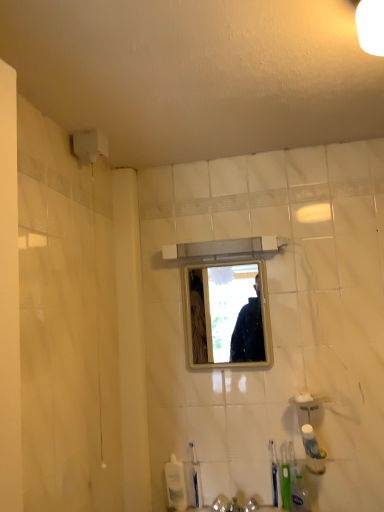
Question: Considering the relative sizes of green plastic toothbrush at lower right, which is the 2th toothbrush in right-to-left order, and blue plastic toothbrush at lower center, which is counted as the 1th toothbrush, starting from the left, in the image provided, is green plastic toothbrush at lower right, which is the 2th toothbrush in right-to-left order, taller than blue plastic toothbrush at lower center, which is counted as the 1th toothbrush, starting from the left,?

Choices:
 (A) no
 (B) yes

Answer: (B)

Question: Is green plastic toothbrush at lower right, which is the 2th toothbrush in right-to-left order, completely or partially outside of blue plastic toothbrush at lower center, which appears as the 3th toothbrush when viewed from the right?

Choices:
 (A) no
 (B) yes

Answer: (B)

Question: Is green plastic toothbrush at lower right, which ranks as the second toothbrush in left-to-right order, behind blue plastic toothbrush at lower center, which appears as the 3th toothbrush when viewed from the right?

Choices:
 (A) yes
 (B) no

Answer: (B)

Question: Could you tell me if green plastic toothbrush at lower right, which ranks as the second toothbrush in left-to-right order, is turned towards blue plastic toothbrush at lower center, which is counted as the 1th toothbrush, starting from the left?

Choices:
 (A) no
 (B) yes

Answer: (A)

Question: Considering the relative positions of green plastic toothbrush at lower right, which is the 2th toothbrush in right-to-left order, and blue plastic toothbrush at lower center, which appears as the 3th toothbrush when viewed from the right, in the image provided, is green plastic toothbrush at lower right, which is the 2th toothbrush in right-to-left order, to the right of blue plastic toothbrush at lower center, which appears as the 3th toothbrush when viewed from the right, from the viewer's perspective?

Choices:
 (A) yes
 (B) no

Answer: (A)

Question: From the image's perspective, does green plastic toothbrush at lower right, which is the 2th toothbrush in right-to-left order, appear lower than blue plastic toothbrush at lower center, which appears as the 3th toothbrush when viewed from the right?

Choices:
 (A) no
 (B) yes

Answer: (A)

Question: Does green plastic toothbrush at lower right, which ranks as the third toothbrush in left-to-right order, have a larger size compared to green plastic toothbrush at lower right, which ranks as the second toothbrush in left-to-right order?

Choices:
 (A) yes
 (B) no

Answer: (A)

Question: From the image's perspective, would you say green plastic toothbrush at lower right, which is the 1th toothbrush from right to left, is shown under green plastic toothbrush at lower right, which is the 2th toothbrush in right-to-left order?

Choices:
 (A) yes
 (B) no

Answer: (B)

Question: Does green plastic toothbrush at lower right, which ranks as the third toothbrush in left-to-right order, come in front of green plastic toothbrush at lower right, which ranks as the second toothbrush in left-to-right order?

Choices:
 (A) yes
 (B) no

Answer: (A)

Question: Is green plastic toothbrush at lower right, which ranks as the third toothbrush in left-to-right order, at the right side of green plastic toothbrush at lower right, which ranks as the second toothbrush in left-to-right order?

Choices:
 (A) yes
 (B) no

Answer: (A)

Question: Is green plastic toothbrush at lower right, which is the 1th toothbrush from right to left, facing away from green plastic toothbrush at lower right, which is the 2th toothbrush in right-to-left order?

Choices:
 (A) yes
 (B) no

Answer: (B)

Question: From a real-world perspective, does green plastic toothbrush at lower right, which ranks as the third toothbrush in left-to-right order, stand above green plastic toothbrush at lower right, which ranks as the second toothbrush in left-to-right order?

Choices:
 (A) yes
 (B) no

Answer: (A)

Question: From a real-world perspective, is green plastic toothbrush at lower right, which ranks as the third toothbrush in left-to-right order, located beneath white plastic toothpaste tube at lower right, which appears as the 2th toiletry when ordered from the bottom?

Choices:
 (A) yes
 (B) no

Answer: (A)